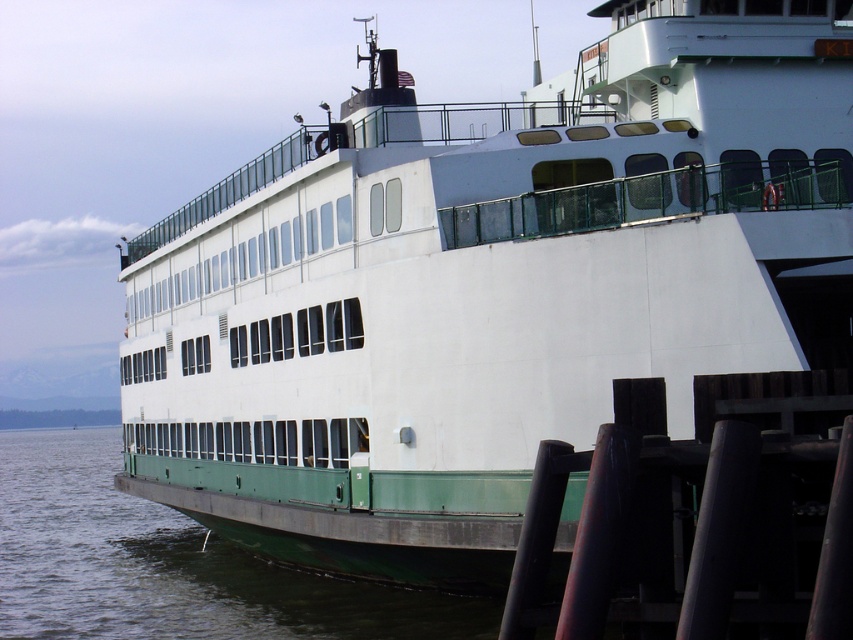
Question: Among these points, which one is nearest to the camera?

Choices:
 (A) (115, 515)
 (B) (616, 518)

Answer: (B)

Question: Does dark brown wooden posts at lower right appear under green matte water at lower left?

Choices:
 (A) no
 (B) yes

Answer: (A)

Question: In this image, where is dark brown wooden posts at lower right located relative to green matte water at lower left?

Choices:
 (A) right
 (B) left

Answer: (A)

Question: Can you confirm if dark brown wooden posts at lower right is wider than green matte water at lower left?

Choices:
 (A) yes
 (B) no

Answer: (B)

Question: Which of the following is the farthest from the observer?

Choices:
 (A) (61, 577)
 (B) (631, 476)

Answer: (A)

Question: Among these points, which one is farthest from the camera?

Choices:
 (A) tap(65, 454)
 (B) tap(827, 433)

Answer: (A)